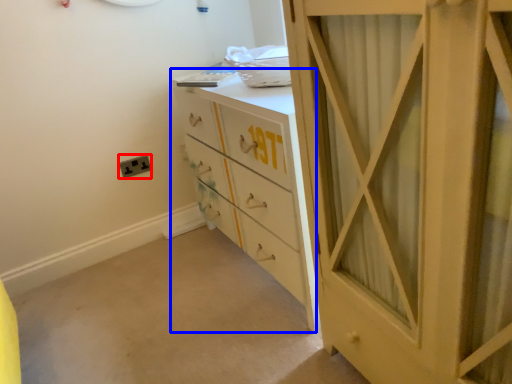
Question: Which point is further to the camera, electric outlet (highlighted by a red box) or chest of drawers (highlighted by a blue box)?

Choices:
 (A) electric outlet
 (B) chest of drawers

Answer: (A)